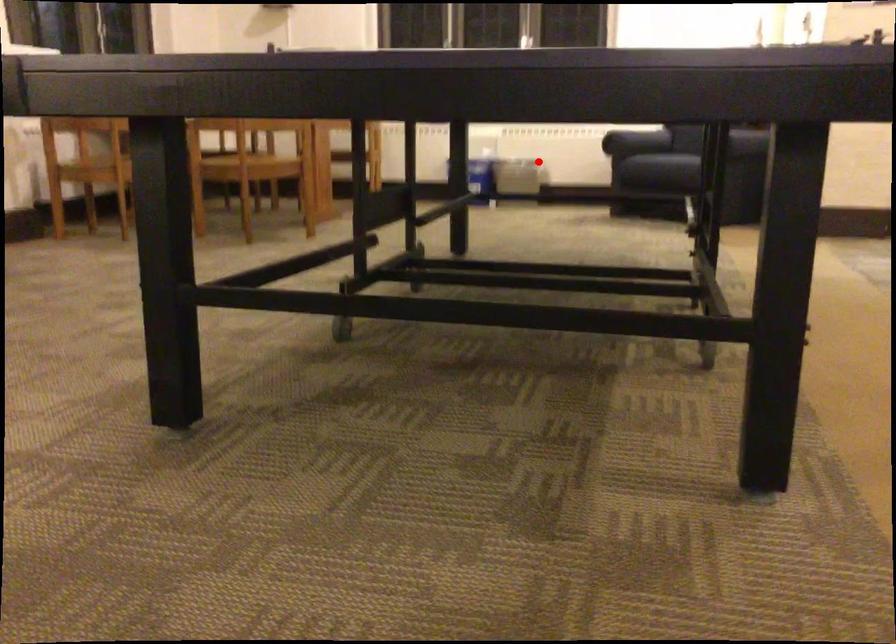
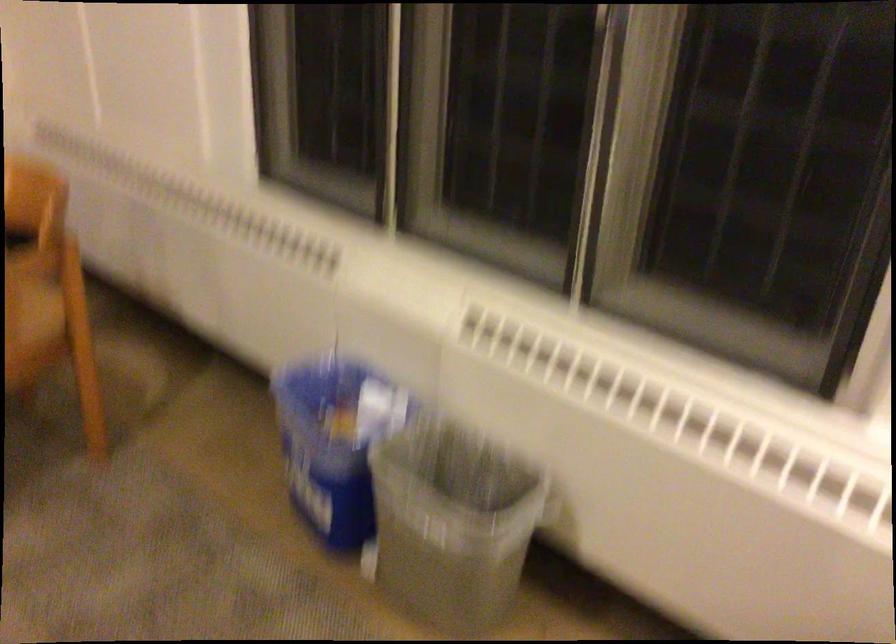
Question: I am providing you with two images of the same scene from different viewpoints. A red point is shown in image1. For the corresponding object point in image2, is it positioned nearer or farther from the camera?

Choices:
 (A) Nearer
 (B) Farther

Answer: (A)